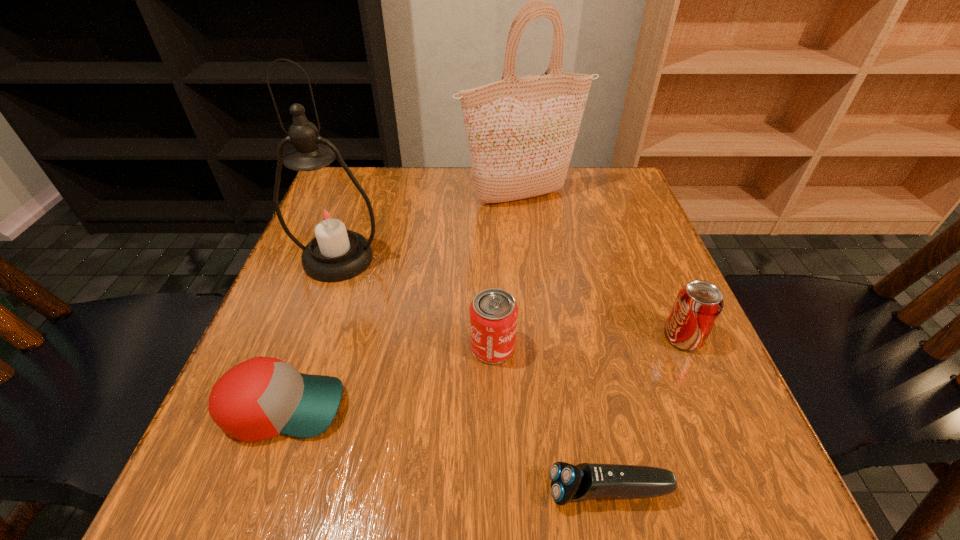
Find the location of `blank space located 0.310m on the left of the soda can`. blank space located 0.310m on the left of the soda can is located at coordinates (490, 338).

Find the location of a particular element. The height and width of the screenshot is (540, 960). vacant space located on the front of the can is located at coordinates (494, 420).

Where is `blank space located 0.380m at the brim of the fifth farthest object`? The width and height of the screenshot is (960, 540). blank space located 0.380m at the brim of the fifth farthest object is located at coordinates (588, 407).

The height and width of the screenshot is (540, 960). What are the coordinates of `vacant area situated on the head of the electric shaver` in the screenshot? It's located at (468, 491).

Where is `vacant space situated on the head of the electric shaver`? vacant space situated on the head of the electric shaver is located at coordinates (319, 491).

This screenshot has width=960, height=540. In order to click on vacant area located on the head of the electric shaver in this screenshot , I will do pyautogui.click(x=490, y=491).

In order to click on object that is at the far edge in this screenshot , I will do `click(521, 132)`.

Where is `object positioned at the near edge`? This screenshot has width=960, height=540. object positioned at the near edge is located at coordinates (569, 483).

Locate an element on the screen. This screenshot has height=540, width=960. oil lamp located at the left edge is located at coordinates (325, 214).

Find the location of a particular element. Image resolution: width=960 pixels, height=540 pixels. baseball cap at the left edge is located at coordinates (263, 397).